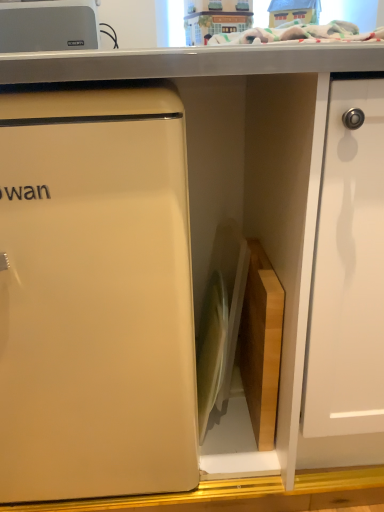
Question: Does white glossy cutting board at center, the 2th appliance positioned from the left, have a larger size compared to matte plastic toy house at upper center?

Choices:
 (A) yes
 (B) no

Answer: (A)

Question: Is the position of white glossy cutting board at center, the 2th appliance positioned from the top, less distant than that of matte plastic toy house at upper center?

Choices:
 (A) yes
 (B) no

Answer: (A)

Question: Is white glossy cutting board at center, the 2th appliance positioned from the top, taller than matte plastic toy house at upper center?

Choices:
 (A) no
 (B) yes

Answer: (B)

Question: Is white glossy cutting board at center, the 2th appliance positioned from the top, further to the viewer compared to matte plastic toy house at upper center?

Choices:
 (A) no
 (B) yes

Answer: (A)

Question: From a real-world perspective, is white glossy cutting board at center, which appears as the first appliance when ordered from the bottom, physically above matte plastic toy house at upper center?

Choices:
 (A) no
 (B) yes

Answer: (A)

Question: Is white glossy cutting board at center, which appears as the first appliance when ordered from the bottom, placed right next to matte plastic toy house at upper center?

Choices:
 (A) yes
 (B) no

Answer: (B)

Question: Is matte plastic toy house at upper center aimed at silver metallic toaster at upper left, the first appliance in the left-to-right sequence?

Choices:
 (A) no
 (B) yes

Answer: (A)

Question: Is matte plastic toy house at upper center in front of silver metallic toaster at upper left, the first appliance in the left-to-right sequence?

Choices:
 (A) yes
 (B) no

Answer: (B)

Question: Is matte plastic toy house at upper center positioned far away from silver metallic toaster at upper left, the first appliance in the left-to-right sequence?

Choices:
 (A) yes
 (B) no

Answer: (B)

Question: From a real-world perspective, does matte plastic toy house at upper center stand above silver metallic toaster at upper left, which ranks as the first appliance in top-to-bottom order?

Choices:
 (A) yes
 (B) no

Answer: (A)

Question: Can you confirm if matte plastic toy house at upper center is positioned to the right of silver metallic toaster at upper left, the second appliance in the bottom-to-top sequence?

Choices:
 (A) no
 (B) yes

Answer: (B)

Question: Considering the relative sizes of matte plastic toy house at upper center and silver metallic toaster at upper left, the first appliance in the left-to-right sequence, in the image provided, is matte plastic toy house at upper center taller than silver metallic toaster at upper left, the first appliance in the left-to-right sequence,?

Choices:
 (A) yes
 (B) no

Answer: (A)

Question: Is white glossy cutting board at center, acting as the first appliance starting from the right, thinner than matte white refrigerator at left?

Choices:
 (A) yes
 (B) no

Answer: (A)